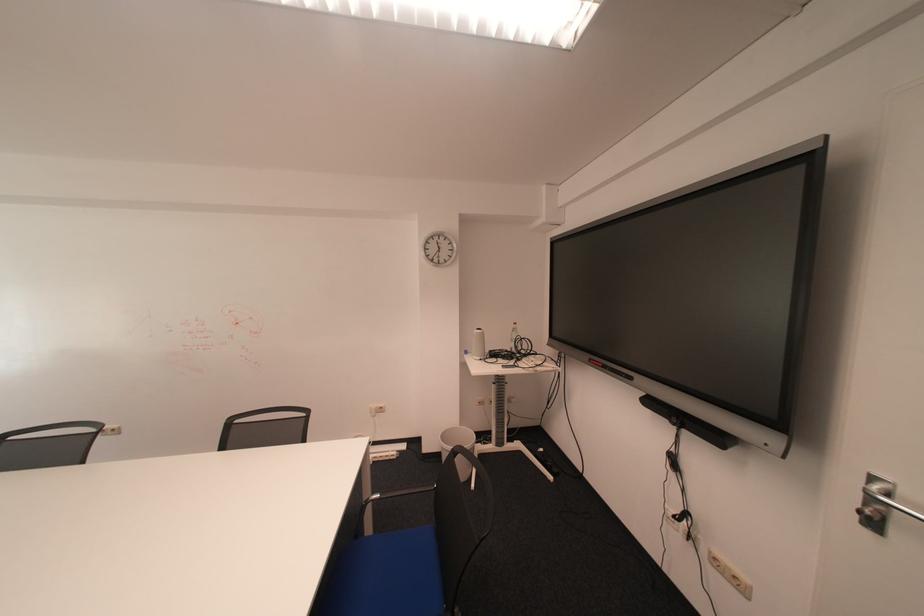
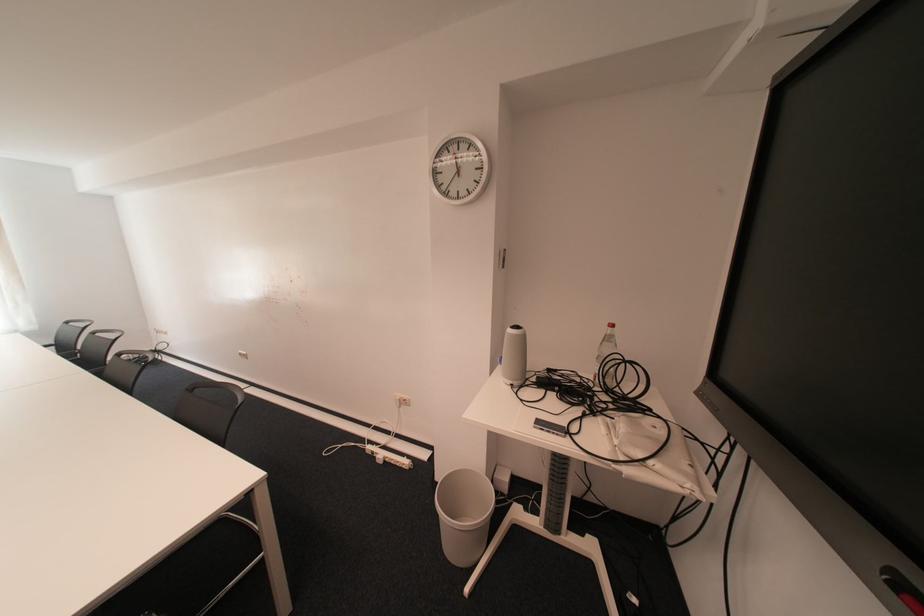
In the second image, find the point that corresponds to pixel 515 369 in the first image.

(545, 428)